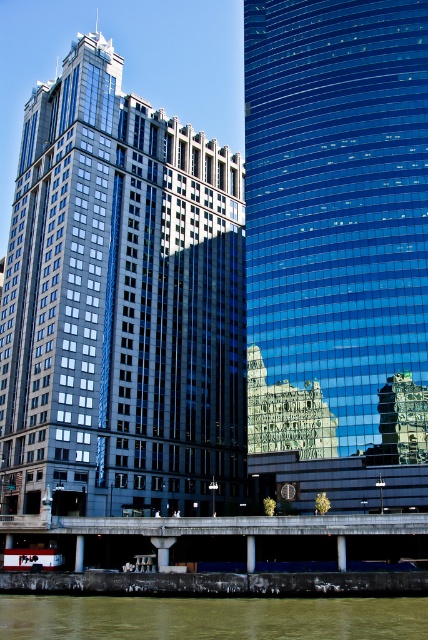
Question: Does shiny glass skyscraper at center have a lesser width compared to greenish water at lower center?

Choices:
 (A) no
 (B) yes

Answer: (A)

Question: Which object is the closest to the greenish water at lower center?

Choices:
 (A) blue glass skyscraper at center
 (B) shiny glass skyscraper at center

Answer: (A)

Question: Which of the following is the farthest from the observer?

Choices:
 (A) greenish water at lower center
 (B) blue glass skyscraper at center

Answer: (B)

Question: Which of the following is the farthest from the observer?

Choices:
 (A) greenish water at lower center
 (B) shiny glass skyscraper at center

Answer: (B)

Question: Can you confirm if blue glass skyscraper at center is positioned above greenish water at lower center?

Choices:
 (A) yes
 (B) no

Answer: (A)

Question: Does blue glass skyscraper at center have a smaller size compared to greenish water at lower center?

Choices:
 (A) yes
 (B) no

Answer: (B)